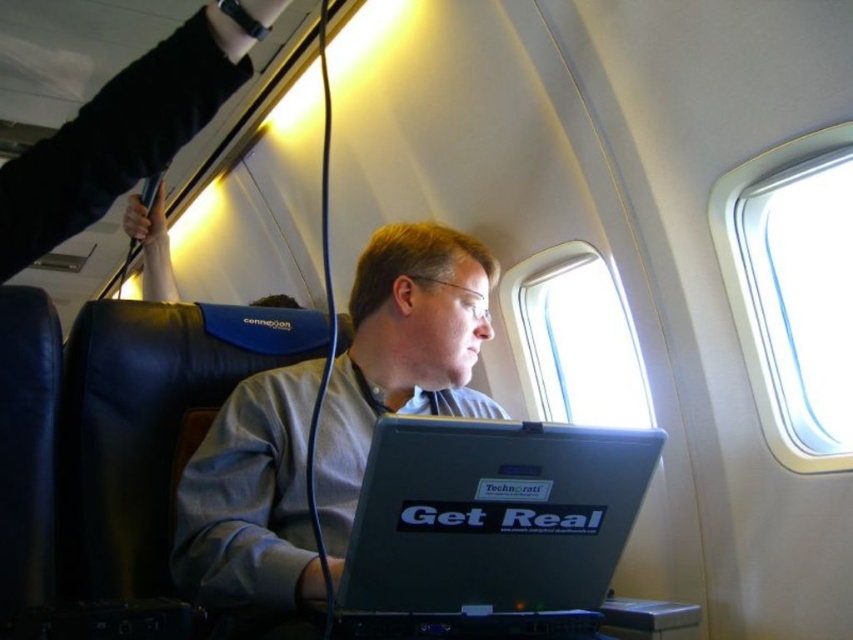
Based on the photo, which is below, gray matte shirt at center or clear plastic airplane window at upper right?

gray matte shirt at center is lower down.

Is gray matte shirt at center thinner than clear plastic airplane window at upper right?

Incorrect, gray matte shirt at center's width is not less than clear plastic airplane window at upper right's.

Find the location of `gray matte shirt at center`. gray matte shirt at center is located at coordinates (401, 355).

The image size is (853, 640). What do you see at coordinates (401, 355) in the screenshot? I see `gray matte shirt at center` at bounding box center [401, 355].

Which is below, gray matte shirt at center or transparent glass airplane window at center?

gray matte shirt at center is below.

Identify the location of gray matte shirt at center. (401, 355).

Does gray matte shirt at center appear under silver/black plastic laptop at center?

Actually, gray matte shirt at center is above silver/black plastic laptop at center.

Based on the photo, who is taller, gray matte shirt at center or silver/black plastic laptop at center?

gray matte shirt at center is taller.

Does point (289, 432) come in front of point (392, 611)?

No, (289, 432) is further to viewer.

At what (x,y) coordinates should I click in order to perform the action: click on gray matte shirt at center. Please return your answer as a coordinate pair (x, y). Looking at the image, I should click on (401, 355).